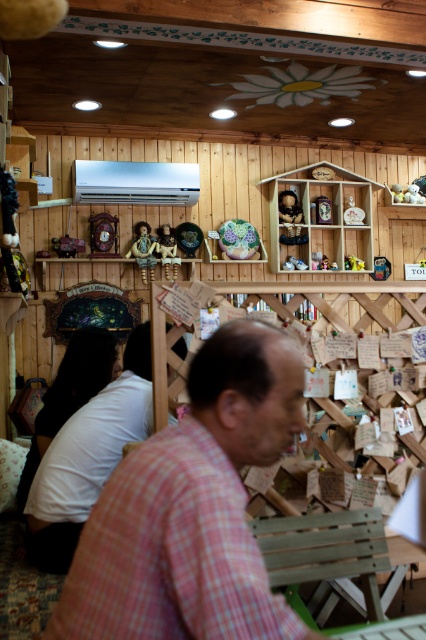
You are standing in the rustic room and want to place a new decorative item on the wooden shelf at upper center. To ensure accuracy, what are the coordinates where you should place it?

The wooden shelf at upper center is located at coordinates point (321,218), so place the item there.

From the picture: You are a delivery person who just received a small package that needs to be placed on the wooden shelf at upper center. The package is the same size as the matte brown doll at upper center. Can you fit the package on the shelf without removing any items?

The wooden shelf at upper center has a larger size compared to matte brown doll at upper center, so yes, the package can be placed on the wooden shelf at upper center since the shelf is bigger than the package.